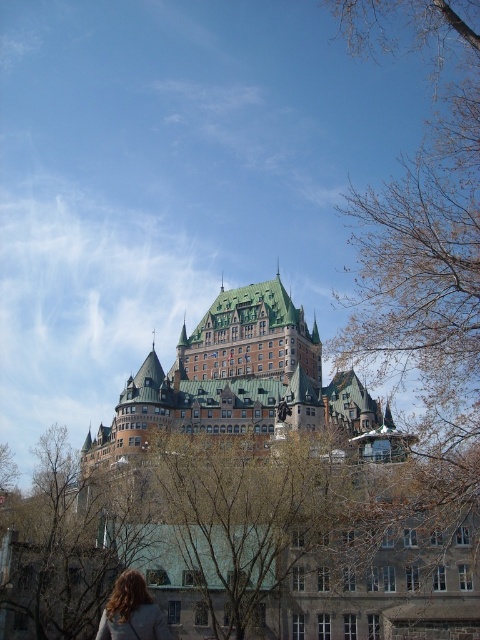
Question: Which object is closer to the camera taking this photo?

Choices:
 (A) bare branches at upper right
 (B) blonde hair at lower left
 (C) green stone castle at center
 (D) green leafy tree at center

Answer: (B)

Question: Which object appears closest to the camera in this image?

Choices:
 (A) blonde hair at lower left
 (B) green leafy tree at center

Answer: (A)

Question: Does green leafy tree at center appear under blonde hair at lower left?

Choices:
 (A) yes
 (B) no

Answer: (B)

Question: Which object is farther from the camera taking this photo?

Choices:
 (A) blonde hair at lower left
 (B) bare branches at upper right
 (C) green stone castle at center
 (D) green leafy tree at center

Answer: (C)

Question: Can you confirm if green stone castle at center is thinner than green leafy tree at center?

Choices:
 (A) yes
 (B) no

Answer: (B)

Question: Can you confirm if green stone castle at center is positioned below blonde hair at lower left?

Choices:
 (A) no
 (B) yes

Answer: (A)